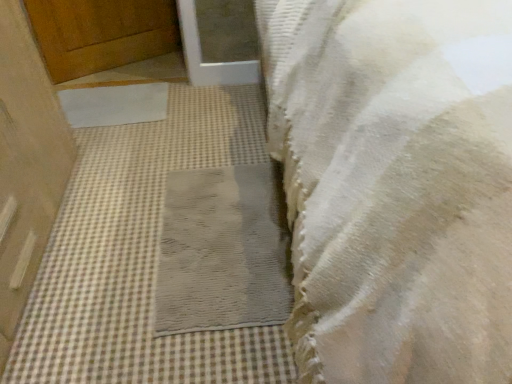
At what (x,y) coordinates should I click in order to perform the action: click on free area below gray textured mat at center, the first mat from the bottom (from a real-world perspective). Please return your answer as a coordinate pair (x, y). This screenshot has width=512, height=384. Looking at the image, I should click on (218, 244).